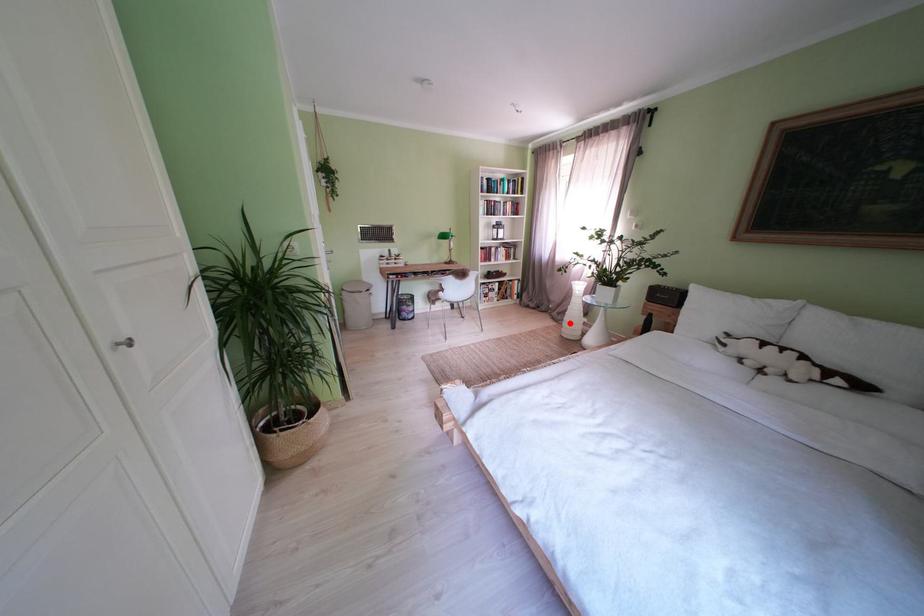
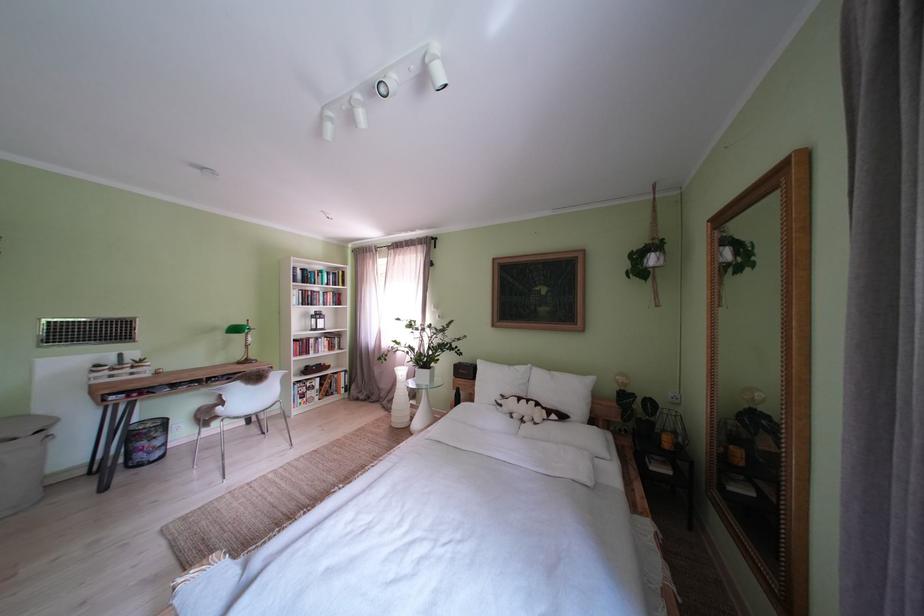
Question: A red point is marked in image1. In image2, is the corresponding 3D point closer to the camera or farther? Reply with the corresponding letter.

Choices:
 (A) The corresponding 3D point is closer.
 (B) The corresponding 3D point is farther.

Answer: (B)